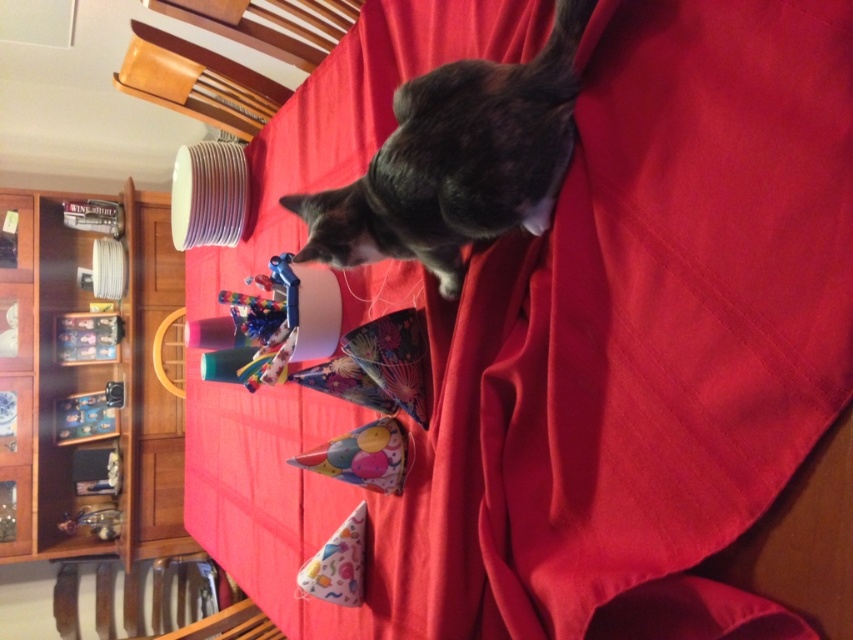
Question: Which is nearer to the dark gray fur cat at upper center?

Choices:
 (A) patterned paper party hat at lower center
 (B) metallic silver toy at lower left
 (C) metallic plastic toy at left
 (D) multicolored paper party hat at center

Answer: (D)

Question: Estimate the real-world distances between objects in this image. Which object is farther from the dark gray fur cat at upper center?

Choices:
 (A) multicolored paper party hat at center
 (B) metallic plastic toy at left

Answer: (B)

Question: In this image, where is dark gray fur cat at upper center located relative to metallic plastic toy at left?

Choices:
 (A) left
 (B) right

Answer: (B)

Question: In this image, where is multicolored paper party hat at center located relative to patterned paper party hat at lower center?

Choices:
 (A) above
 (B) below

Answer: (A)

Question: Which object is farther from the camera taking this photo?

Choices:
 (A) metallic silver toy at lower left
 (B) dark gray fur cat at upper center
 (C) metallic plastic toy at left
 (D) multicolored paper party hat at center

Answer: (C)

Question: Is patterned paper party hat at lower center further to the viewer compared to metallic plastic toy at left?

Choices:
 (A) no
 (B) yes

Answer: (A)